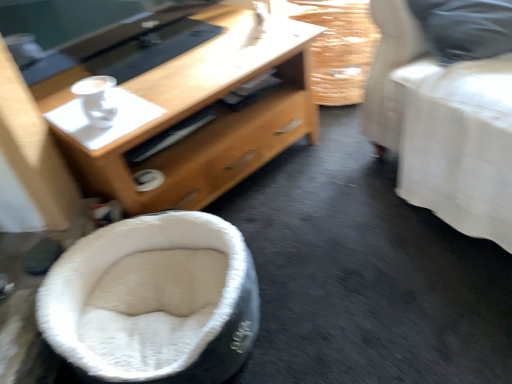
Question: Considering the relative sizes of white glossy cup at upper left and burlap-like fabric basket at upper right in the image provided, is white glossy cup at upper left taller than burlap-like fabric basket at upper right?

Choices:
 (A) no
 (B) yes

Answer: (A)

Question: Is burlap-like fabric basket at upper right surrounded by white glossy cup at upper left?

Choices:
 (A) yes
 (B) no

Answer: (B)

Question: Can you confirm if white glossy cup at upper left is wider than burlap-like fabric basket at upper right?

Choices:
 (A) no
 (B) yes

Answer: (A)

Question: From the image's perspective, is white glossy cup at upper left located above burlap-like fabric basket at upper right?

Choices:
 (A) yes
 (B) no

Answer: (B)

Question: Is white glossy cup at upper left positioned with its back to burlap-like fabric basket at upper right?

Choices:
 (A) no
 (B) yes

Answer: (A)

Question: From the image's perspective, is white fabric bed at right positioned above or below burlap-like fabric basket at upper right?

Choices:
 (A) below
 (B) above

Answer: (A)

Question: Is point (411, 162) closer or farther from the camera than point (306, 1)?

Choices:
 (A) farther
 (B) closer

Answer: (B)

Question: From their relative heights in the image, would you say white fabric bed at right is taller or shorter than burlap-like fabric basket at upper right?

Choices:
 (A) short
 (B) tall

Answer: (B)

Question: Is white fabric bed at right inside or outside of burlap-like fabric basket at upper right?

Choices:
 (A) inside
 (B) outside

Answer: (B)

Question: In terms of height, does wooden desk at center look taller or shorter compared to white fuzzy bean bag at lower left?

Choices:
 (A) tall
 (B) short

Answer: (A)

Question: Does point [241, 57] appear closer or farther from the camera than point [134, 319]?

Choices:
 (A) farther
 (B) closer

Answer: (A)

Question: Based on their sizes in the image, would you say wooden desk at center is bigger or smaller than white fuzzy bean bag at lower left?

Choices:
 (A) small
 (B) big

Answer: (B)

Question: Would you say wooden desk at center is to the left or to the right of white fuzzy bean bag at lower left in the picture?

Choices:
 (A) left
 (B) right

Answer: (B)

Question: Considering the positions of white glossy cup at upper left and wooden desk at center in the image, is white glossy cup at upper left wider or thinner than wooden desk at center?

Choices:
 (A) thin
 (B) wide

Answer: (A)

Question: Considering their positions, is white glossy cup at upper left located in front of or behind wooden desk at center?

Choices:
 (A) front
 (B) behind

Answer: (B)